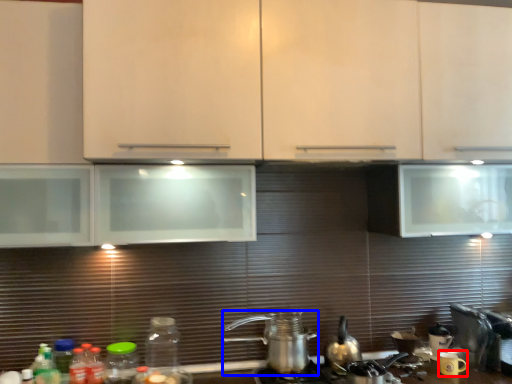
Question: Which object is further to the camera taking this photo, appliance (highlighted by a red box) or kitchen appliance (highlighted by a blue box)?

Choices:
 (A) appliance
 (B) kitchen appliance

Answer: (A)